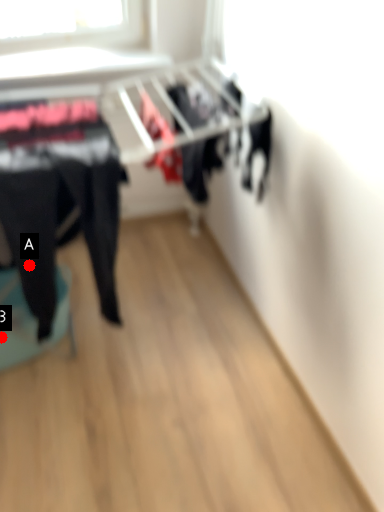
Question: Two points are circled on the image, labeled by A and B beside each circle. Which point appears closest to the camera in this image?

Choices:
 (A) A is closer
 (B) B is closer

Answer: (A)